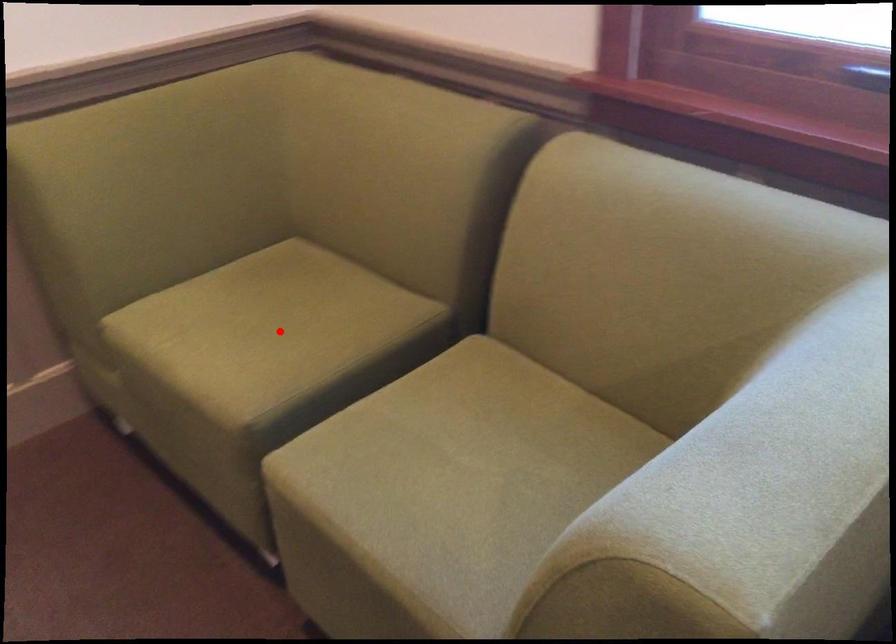
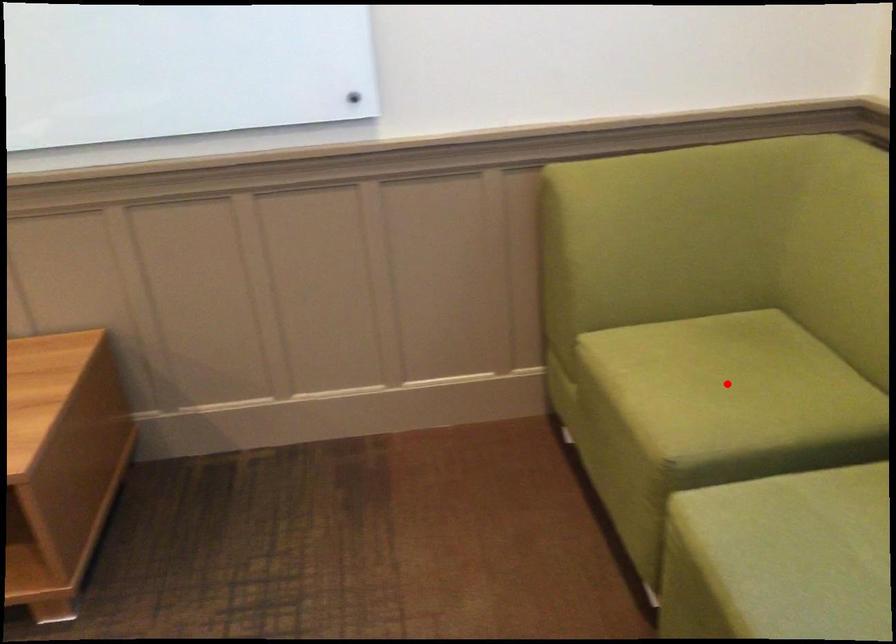
I am providing you with two images of the same scene from different viewpoints. A red point is marked on the first image and another point is marked on the second image. Does the point marked in image1 correspond to the same location as the one in image2?

Yes